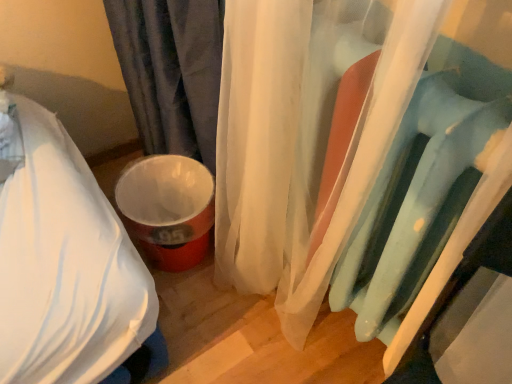
Where is `translucent fabric at right`? Image resolution: width=512 pixels, height=384 pixels. translucent fabric at right is located at coordinates (353, 149).

The height and width of the screenshot is (384, 512). What do you see at coordinates (353, 149) in the screenshot? I see `translucent fabric at right` at bounding box center [353, 149].

You are a GUI agent. You are given a task and a screenshot of the screen. Output one action in this format:
    pyautogui.click(x=<x>, y=<y>)
    Task: Click on the translucent fabric at right
    The width and height of the screenshot is (512, 384).
    Given the screenshot: What is the action you would take?
    pyautogui.click(x=353, y=149)